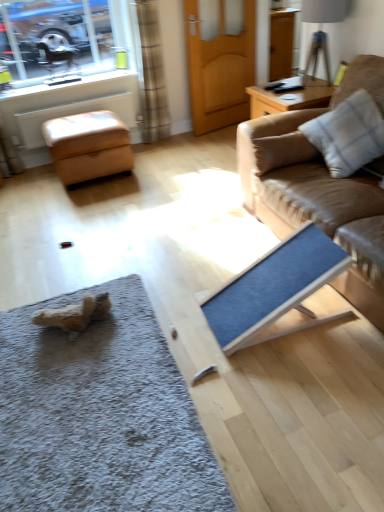
Where is `free point below brown textured curtain at upper left (from a real-world perspective)`? The width and height of the screenshot is (384, 512). free point below brown textured curtain at upper left (from a real-world perspective) is located at coordinates (165, 137).